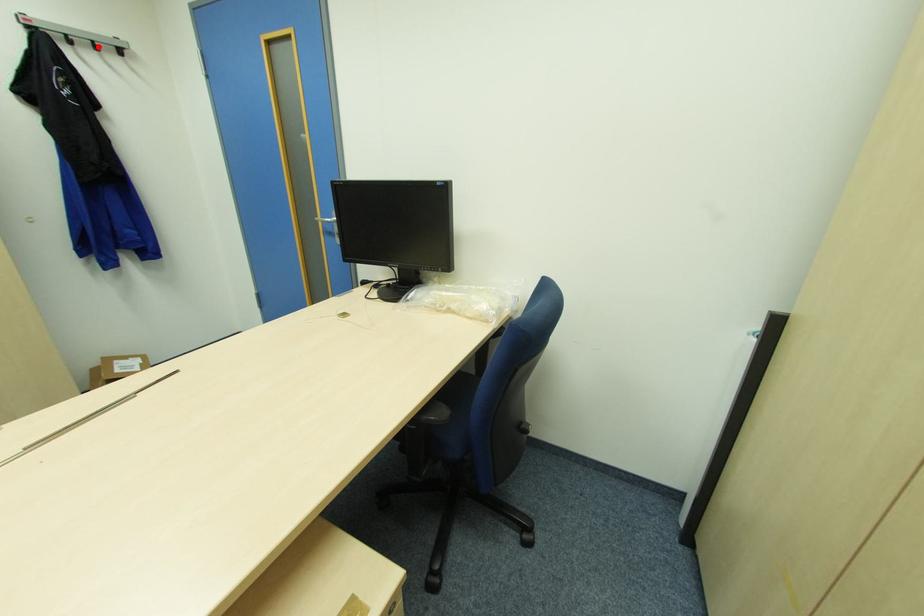
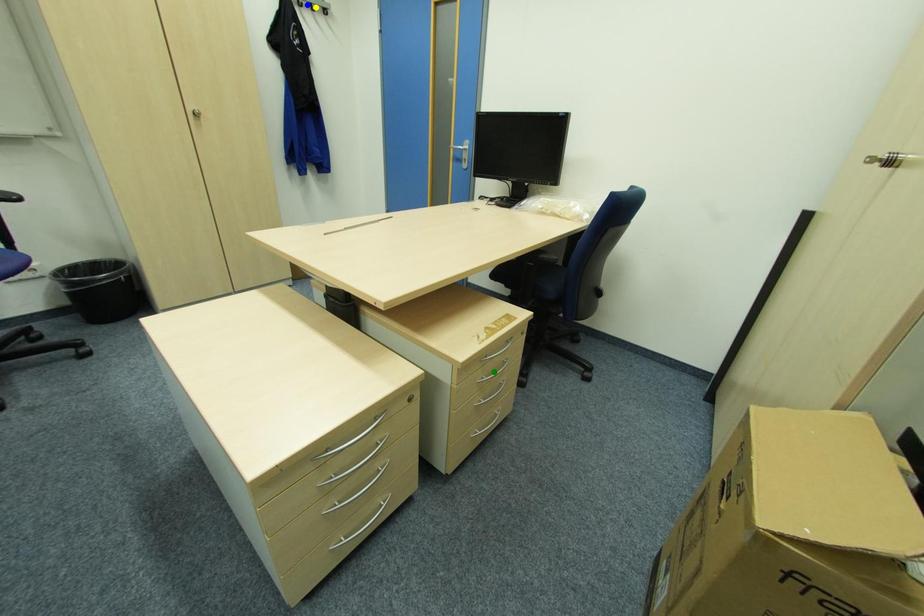
Question: I am providing you with two images of the same scene from different viewpoints. A red point is marked on the first image. You are given multiple points on the second image. Can you choose the point in image 2 that corresponds to the point in image 1?

Choices:
 (A) blue point
 (B) green point
 (C) yellow point

Answer: (C)